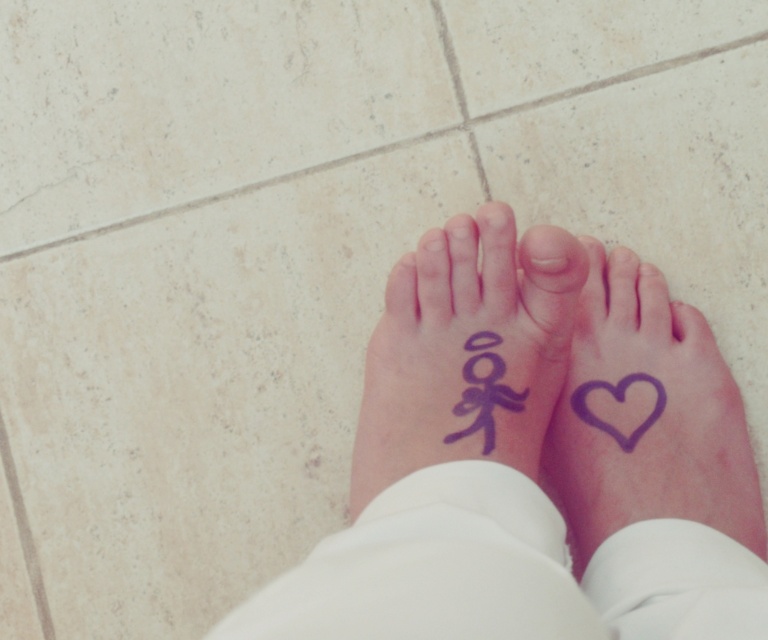
You are a photographer setting up a shot of the white smooth fabric at lower center. You want to position your camera so that it is exactly 24.71 inches away from the fabric. Given that the fabric is on the floor, how should you adjust your camera placement?

The white smooth fabric at lower center is 24.71 inches away from the viewer, so you should position your camera exactly 24.71 inches away from the fabric to capture it at the correct distance.

You are a photographer setting up a shoot in the scene described. You need to place a small prop exactly at the coordinates mentioned in the description of the white smooth fabric at lower center. Where should you position the prop relative to the visible feet?

The white smooth fabric at lower center is located at point (480, 500), so you should position the prop at those coordinates relative to the visible feet.